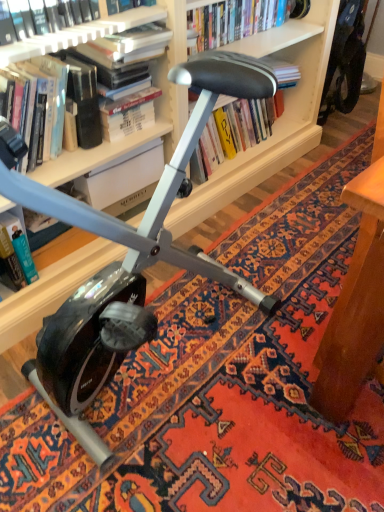
Question: From the image's perspective, would you say hardcover book at center, positioned as the 1th book in right-to-left order, is positioned over hardcover book at center?

Choices:
 (A) yes
 (B) no

Answer: (A)

Question: Is hardcover book at center, positioned as the 1th book in right-to-left order, positioned far away from hardcover book at center?

Choices:
 (A) no
 (B) yes

Answer: (A)

Question: Is hardcover book at center, which appears as the fourth book when viewed from the left, bigger than hardcover book at center?

Choices:
 (A) no
 (B) yes

Answer: (B)

Question: Considering the relative positions of hardcover book at center, which appears as the fourth book when viewed from the left, and hardcover book at center in the image provided, is hardcover book at center, which appears as the fourth book when viewed from the left, behind hardcover book at center?

Choices:
 (A) no
 (B) yes

Answer: (B)

Question: Could hardcover book at center be considered to be inside hardcover book at center, which appears as the fourth book when viewed from the left?

Choices:
 (A) no
 (B) yes

Answer: (A)

Question: From a real-world perspective, is hardcover book at center, which appears as the fourth book when viewed from the left, beneath hardcover book at center?

Choices:
 (A) no
 (B) yes

Answer: (B)

Question: Is hardcover book at left, which is counted as the 4th book, starting from the right, touching matte white bookcase at upper center?

Choices:
 (A) no
 (B) yes

Answer: (A)

Question: Is hardcover book at left, the first book positioned from the left, at the left side of matte white bookcase at upper center?

Choices:
 (A) yes
 (B) no

Answer: (A)

Question: Can you confirm if hardcover book at left, which is counted as the 4th book, starting from the right, is shorter than matte white bookcase at upper center?

Choices:
 (A) yes
 (B) no

Answer: (A)

Question: Would you say hardcover book at left, which is counted as the 4th book, starting from the right, is outside matte white bookcase at upper center?

Choices:
 (A) no
 (B) yes

Answer: (B)

Question: Would you say matte white bookcase at upper center is part of hardcover book at left, which is counted as the 4th book, starting from the right,'s contents?

Choices:
 (A) no
 (B) yes

Answer: (A)

Question: Can you confirm if hardcover book at left, the first book positioned from the left, is positioned to the right of matte white bookcase at upper center?

Choices:
 (A) no
 (B) yes

Answer: (A)

Question: Is hardcover book at center, which appears as the fourth book when viewed from the left, behind hardcover book at left, which is counted as the 4th book, starting from the right?

Choices:
 (A) yes
 (B) no

Answer: (A)